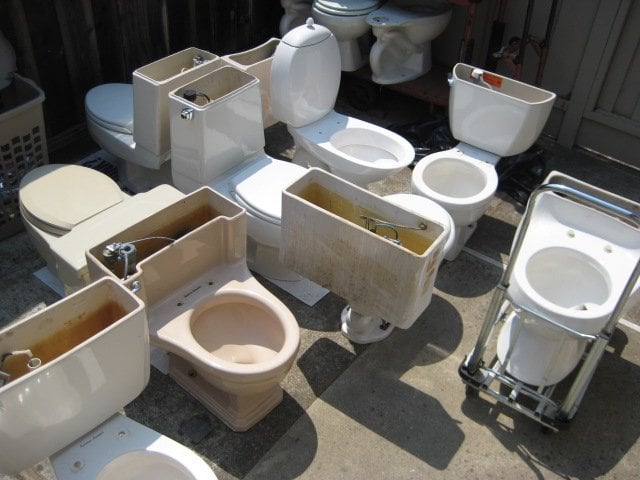
What are the coordinates of `toilet rim` in the screenshot? It's located at (283, 358).